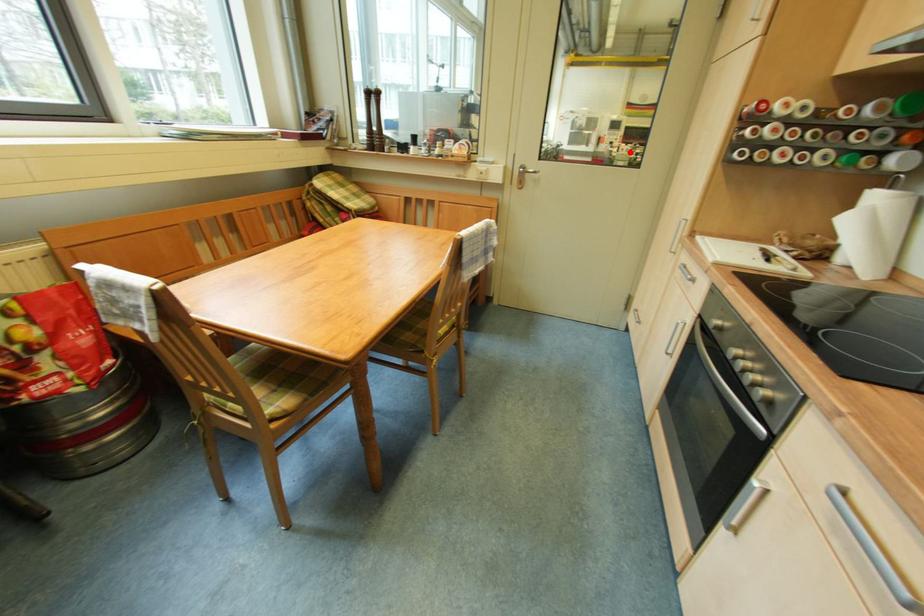
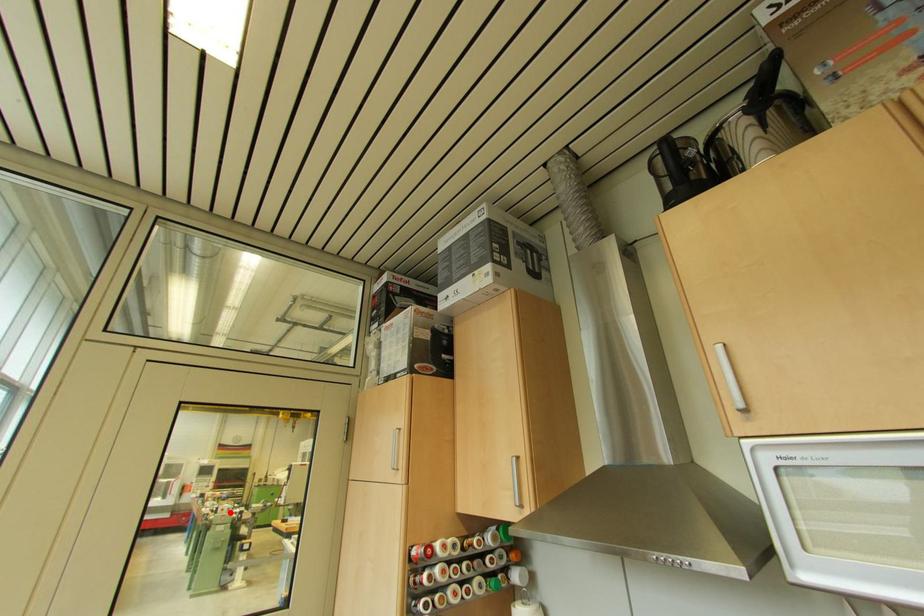
I am providing you with two images of the same scene from different viewpoints. A red point is marked on the first image and another point is marked on the second image. Is the red point in image1 aligned with the point shown in image2?

Yes